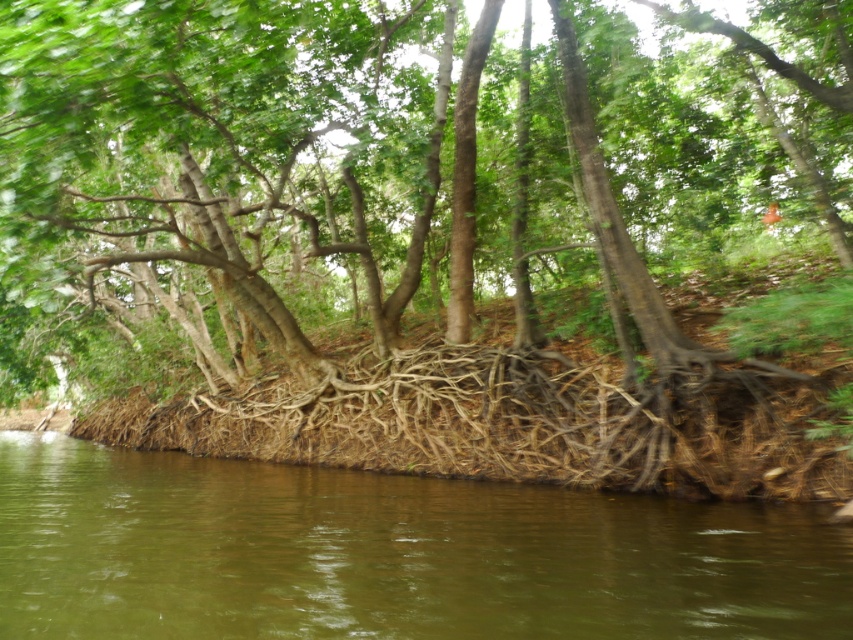
Does brown rough roots at center have a greater height compared to brown muddy water at lower center?

Yes.

Who is more forward, (828, 83) or (238, 484)?

Point (238, 484) is more forward.

The height and width of the screenshot is (640, 853). I want to click on brown rough roots at center, so click(x=386, y=170).